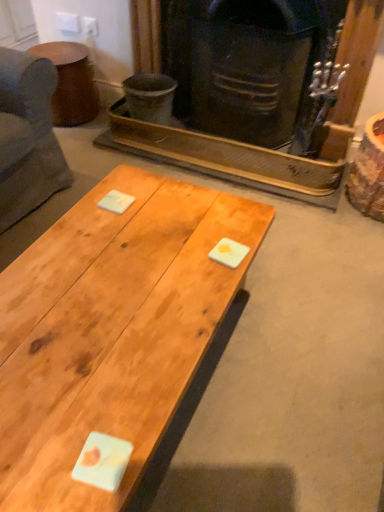
Question: From the image's perspective, would you say natural wood coffee table at center is positioned over dark brown wood fireplace at center?

Choices:
 (A) yes
 (B) no

Answer: (B)

Question: Can you confirm if natural wood coffee table at center is shorter than dark brown wood fireplace at center?

Choices:
 (A) no
 (B) yes

Answer: (B)

Question: Could you tell me if natural wood coffee table at center is turned towards dark brown wood fireplace at center?

Choices:
 (A) yes
 (B) no

Answer: (B)

Question: Is natural wood coffee table at center thinner than dark brown wood fireplace at center?

Choices:
 (A) yes
 (B) no

Answer: (B)

Question: Is natural wood coffee table at center at the right side of dark brown wood fireplace at center?

Choices:
 (A) yes
 (B) no

Answer: (B)

Question: Is natural wood coffee table at center far away from dark brown wood fireplace at center?

Choices:
 (A) yes
 (B) no

Answer: (A)

Question: Is brown matte side table at upper left touching dark brown wood fireplace at center?

Choices:
 (A) no
 (B) yes

Answer: (A)

Question: Considering the relative positions of brown matte side table at upper left and dark brown wood fireplace at center in the image provided, is brown matte side table at upper left to the left of dark brown wood fireplace at center from the viewer's perspective?

Choices:
 (A) no
 (B) yes

Answer: (B)

Question: From a real-world perspective, does brown matte side table at upper left sit lower than dark brown wood fireplace at center?

Choices:
 (A) yes
 (B) no

Answer: (A)

Question: Is brown matte side table at upper left positioned with its back to dark brown wood fireplace at center?

Choices:
 (A) no
 (B) yes

Answer: (A)

Question: Is brown matte side table at upper left smaller than dark brown wood fireplace at center?

Choices:
 (A) no
 (B) yes

Answer: (B)

Question: From a real-world perspective, is brown matte side table at upper left located higher than dark brown wood fireplace at center?

Choices:
 (A) yes
 (B) no

Answer: (B)

Question: Does natural wood coffee table at center turn towards brown matte side table at upper left?

Choices:
 (A) no
 (B) yes

Answer: (A)